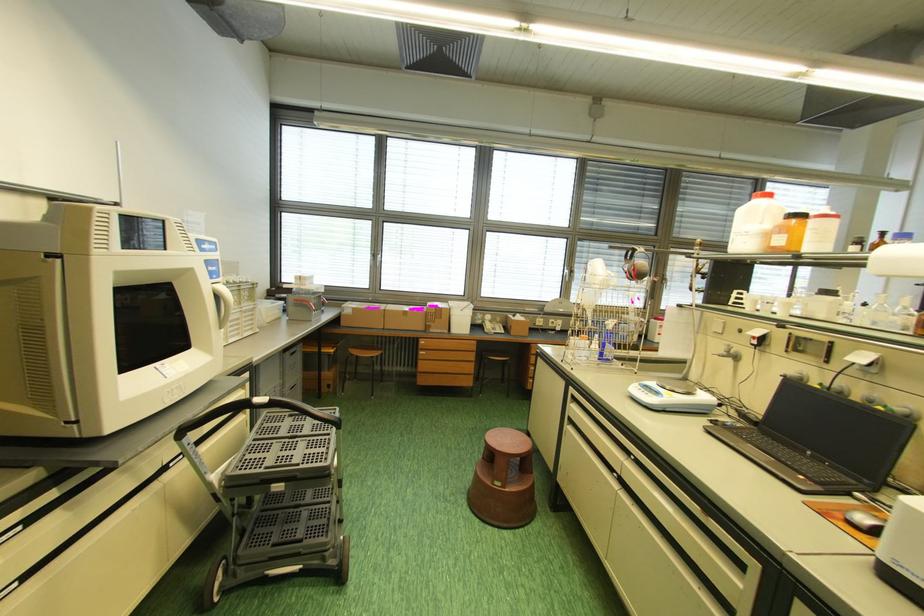
This screenshot has height=616, width=924. I want to click on wooden drawer handle, so click(428, 354).